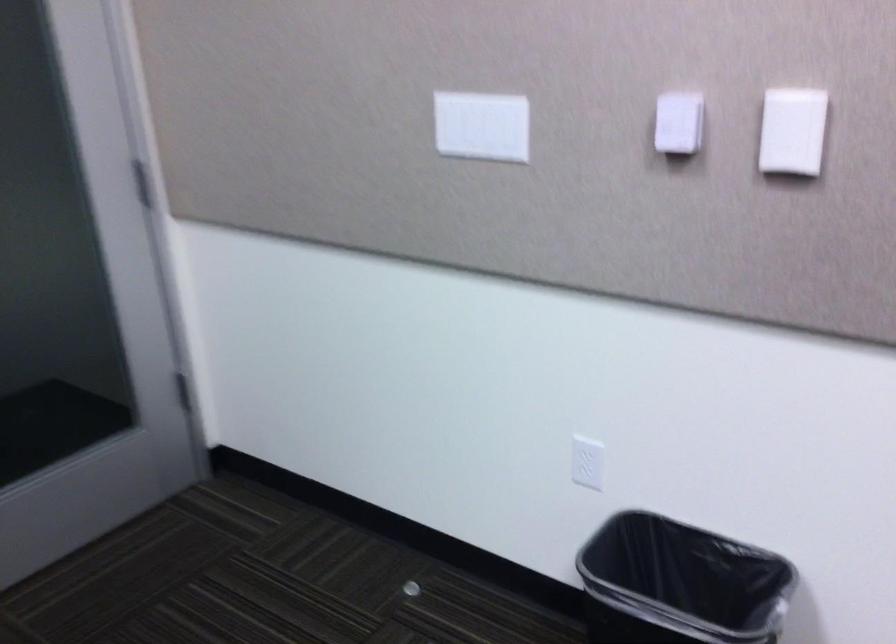
Find where to lift the small round object. Please return your answer as a coordinate pair (x, y).

(410, 589)